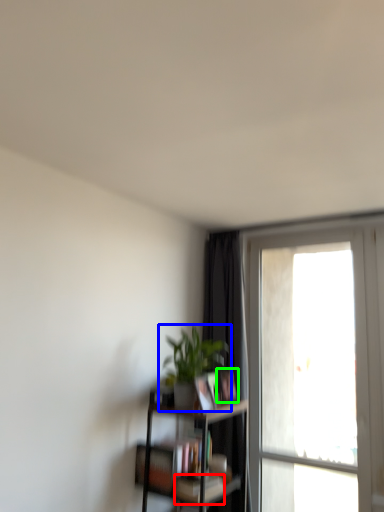
Question: Which object is positioned closest to book (highlighted by a red box)? Select from houseplant (highlighted by a blue box) and book (highlighted by a green box).

Choices:
 (A) houseplant
 (B) book

Answer: (B)